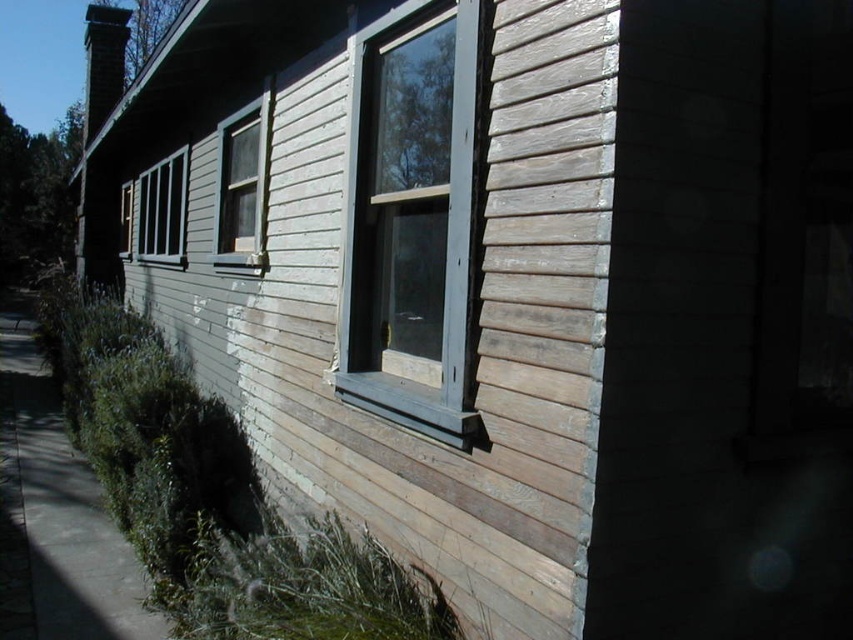
Question: Considering the real-world distances, which object is closest to the wooden frame window at center?

Choices:
 (A) matte wood window at left
 (B) clear glass window at upper left

Answer: (B)

Question: Can you confirm if wooden frame window at center is thinner than clear glass window at left?

Choices:
 (A) yes
 (B) no

Answer: (A)

Question: From the image, what is the correct spatial relationship of wooden frame window at center in relation to clear glass window at upper left?

Choices:
 (A) above
 (B) below

Answer: (B)

Question: Which point is closer to the camera?

Choices:
 (A) wooden frame window at center
 (B) clear glass window at left
 (C) matte wood window at left

Answer: (A)

Question: Which point appears farthest from the camera in this image?

Choices:
 (A) (265, 125)
 (B) (144, 241)
 (C) (462, 381)

Answer: (B)

Question: Observing the image, what is the correct spatial positioning of wooden frame window at center in reference to matte wood window at left?

Choices:
 (A) above
 (B) below

Answer: (B)